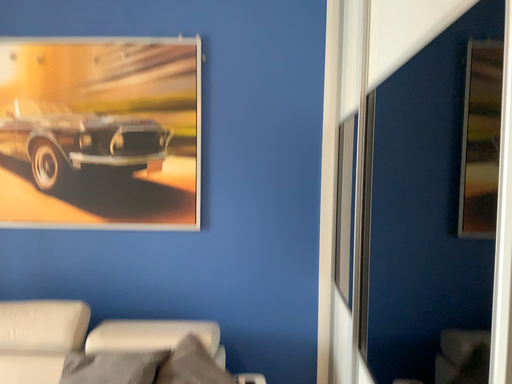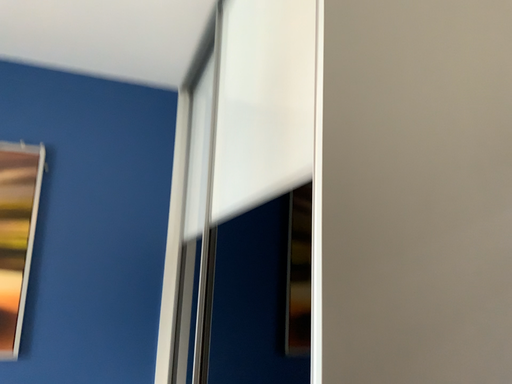
Question: Which way did the camera rotate in the video?

Choices:
 (A) rotated upward
 (B) rotated downward

Answer: (A)